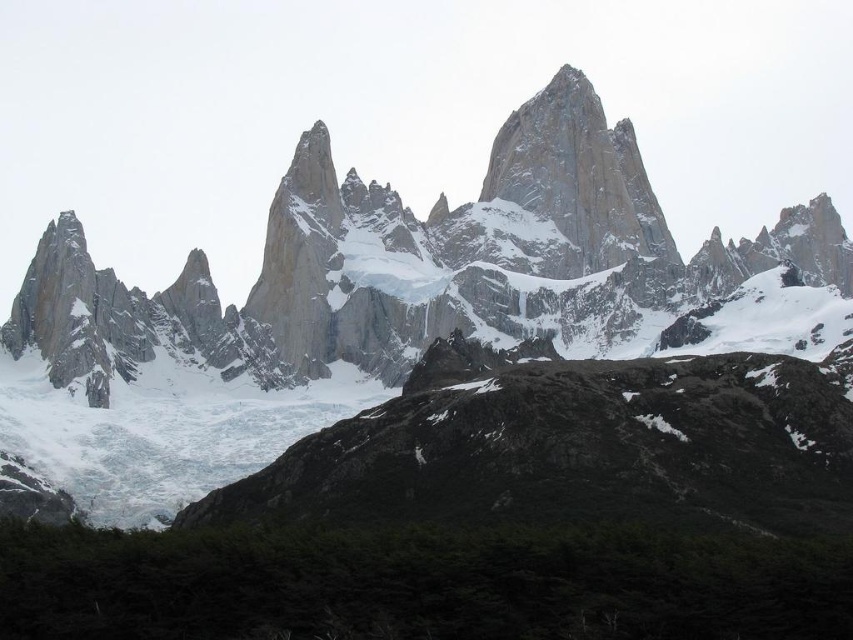
You are a geologist analyzing a mountain landscape. You see the granite rock formation at center. What are the coordinates of its 2D location in the image?

The granite rock formation at center has a 2D location at point [416,262].